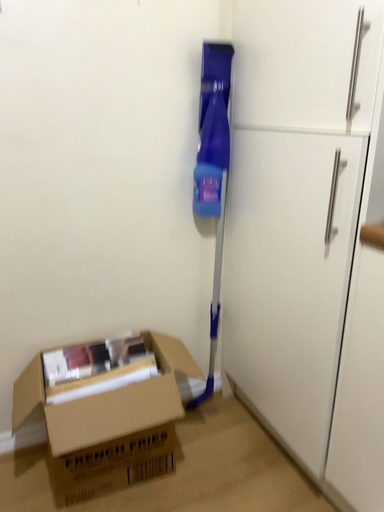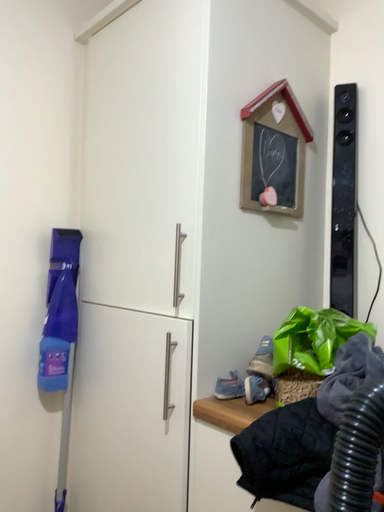
Question: Which way did the camera rotate in the video?

Choices:
 (A) rotated upward
 (B) rotated downward

Answer: (A)